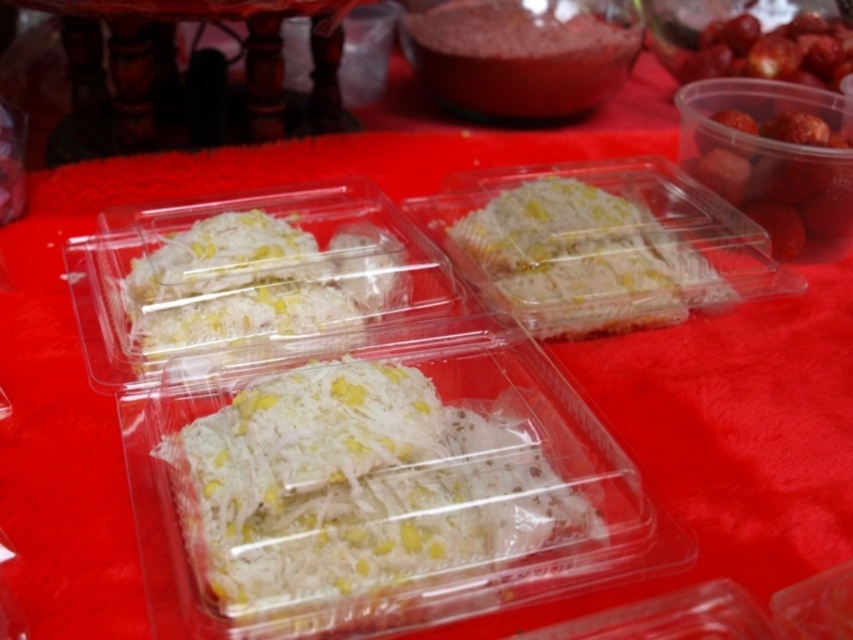
You are a food vendor who needs to place a new container that is 16 inches wide between the white translucent cake at center and the smooth pink powder at center. Will the container fit in the space between them?

The distance between the white translucent cake at center and the smooth pink powder at center is 15.88 inches. Since the container is 16 inches wide, it will not fit in the space between them as the required space is slightly larger than the available gap.

You are a customer at a food stall and want to buy both the white translucent cake at center and the smooth pink powder at center. Which item is closer to you?

The white translucent cake at center is closer to you because it is in front of the smooth pink powder at center.

You are a customer at a food stall and want to know which item is bigger between the white translucent rice at center and the smooth pink powder at center. Which one is larger?

The smooth pink powder at center is larger than the white translucent rice at center.